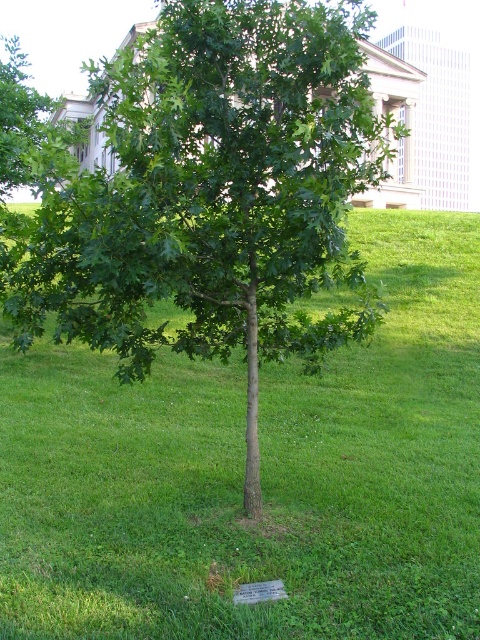
You are a gardener who needs to mow the lawn around the green leafy tree at center and the green grass at center. Which area requires a larger mower to cover the entire area?

The green grass at center is bigger than the green leafy tree at center, so the gardener needs a larger mower to cover the entire area of the green grass at center.

You are standing in a park and see the green grass at center and the green leafy tree at center. Which object is located to the right of the other?

The green grass at center is positioned on the right side of green leafy tree at center.

You are a gardener who wants to plant a new flower bed around the green leafy tree at center. However, there is already green grass at center. Based on the scene, can you determine if the grass is covering the tree or the tree is covering the grass?

The green grass at center is positioned over green leafy tree at center, meaning the grass is covering the tree.